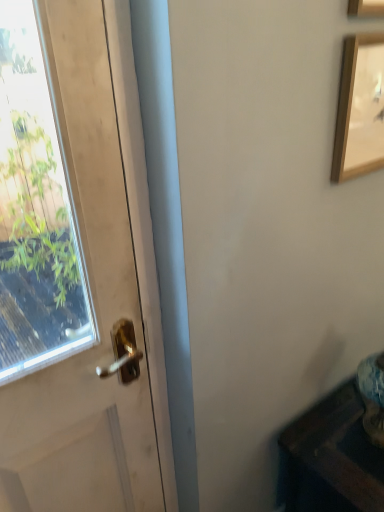
Question: Can you confirm if wooden picture frame at upper right, the 2th picture frame positioned from the bottom, is wider than white matte door at left?

Choices:
 (A) yes
 (B) no

Answer: (A)

Question: Considering the relative positions of wooden picture frame at upper right, the 2th picture frame positioned from the bottom, and white matte door at left in the image provided, is wooden picture frame at upper right, the 2th picture frame positioned from the bottom, to the left of white matte door at left from the viewer's perspective?

Choices:
 (A) yes
 (B) no

Answer: (B)

Question: Is white matte door at left surrounded by wooden picture frame at upper right, acting as the first picture frame starting from the top?

Choices:
 (A) no
 (B) yes

Answer: (A)

Question: Is wooden picture frame at upper right, acting as the first picture frame starting from the top, bigger than white matte door at left?

Choices:
 (A) yes
 (B) no

Answer: (B)

Question: Is wooden picture frame at upper right, acting as the first picture frame starting from the top, facing away from white matte door at left?

Choices:
 (A) yes
 (B) no

Answer: (B)

Question: Is point (347, 4) positioned closer to the camera than point (107, 492)?

Choices:
 (A) closer
 (B) farther

Answer: (A)

Question: Looking at their shapes, would you say wooden picture frame at upper right, acting as the first picture frame starting from the top, is wider or thinner than white matte door at left?

Choices:
 (A) thin
 (B) wide

Answer: (B)

Question: Is wooden picture frame at upper right, the 2th picture frame positioned from the bottom, bigger or smaller than white matte door at left?

Choices:
 (A) big
 (B) small

Answer: (B)

Question: Visually, is wooden picture frame at upper right, the 2th picture frame positioned from the bottom, positioned to the left or to the right of white matte door at left?

Choices:
 (A) left
 (B) right

Answer: (B)

Question: Is wooden picture frame at upper right, acting as the first picture frame starting from the top, wider or thinner than wooden table at lower right?

Choices:
 (A) thin
 (B) wide

Answer: (A)

Question: Does point (382, 5) appear closer or farther from the camera than point (312, 411)?

Choices:
 (A) farther
 (B) closer

Answer: (B)

Question: Do you think wooden picture frame at upper right, the 2th picture frame positioned from the bottom, is within wooden table at lower right, or outside of it?

Choices:
 (A) inside
 (B) outside

Answer: (B)

Question: Is wooden picture frame at upper right, acting as the first picture frame starting from the top, taller or shorter than wooden table at lower right?

Choices:
 (A) tall
 (B) short

Answer: (B)

Question: Considering the positions of wooden picture frame at upper right, which appears as the first picture frame when ordered from the bottom, and wooden picture frame at upper right, the 2th picture frame positioned from the bottom, in the image, is wooden picture frame at upper right, which appears as the first picture frame when ordered from the bottom, wider or thinner than wooden picture frame at upper right, the 2th picture frame positioned from the bottom,?

Choices:
 (A) wide
 (B) thin

Answer: (B)

Question: Is point (357, 162) positioned closer to the camera than point (370, 6)?

Choices:
 (A) farther
 (B) closer

Answer: (A)